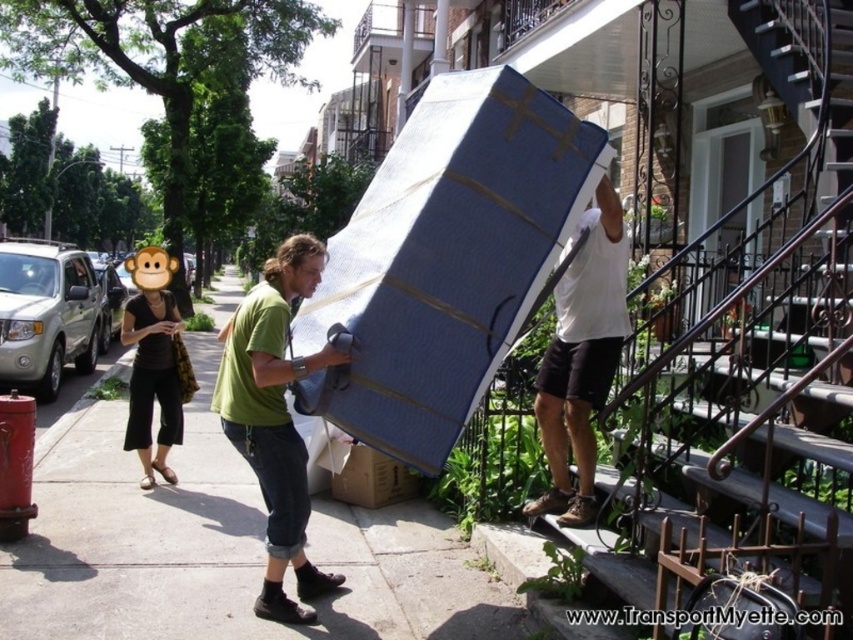
Between green cotton shirt at center and white matte mattress at upper right, which one is positioned higher?

Positioned higher is white matte mattress at upper right.

Who is positioned more to the left, green cotton shirt at center or white matte mattress at upper right?

green cotton shirt at center

The width and height of the screenshot is (853, 640). Find the location of `green cotton shirt at center`. green cotton shirt at center is located at coordinates (276, 419).

Which is below, smooth concrete sidewalk at center or white matte mattress at upper right?

smooth concrete sidewalk at center is below.

Is smooth concrete sidewalk at center positioned before white matte mattress at upper right?

Yes.

Between point (357, 627) and point (592, 298), which one is positioned in front?

Point (357, 627) is in front.

Image resolution: width=853 pixels, height=640 pixels. Find the location of `smooth concrete sidewalk at center`. smooth concrete sidewalk at center is located at coordinates 222,547.

Is point (305, 467) positioned after point (335, 483)?

No, (305, 467) is closer to viewer.

Who is taller, green cotton shirt at center or cardboard box at lower center?

With more height is green cotton shirt at center.

This screenshot has width=853, height=640. Identify the location of green cotton shirt at center. (276, 419).